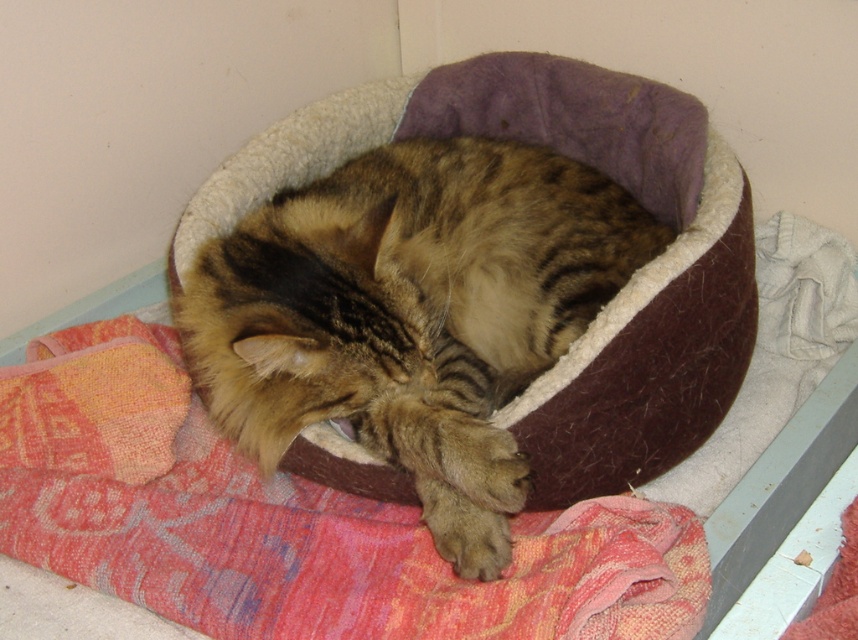
Can you confirm if tabby fur cat at center is positioned to the right of textured pink fabric at lower center?

Yes, tabby fur cat at center is to the right of textured pink fabric at lower center.

Which of these two, tabby fur cat at center or textured pink fabric at lower center, stands shorter?

textured pink fabric at lower center is shorter.

Locate an element on the screen. tabby fur cat at center is located at coordinates 412,314.